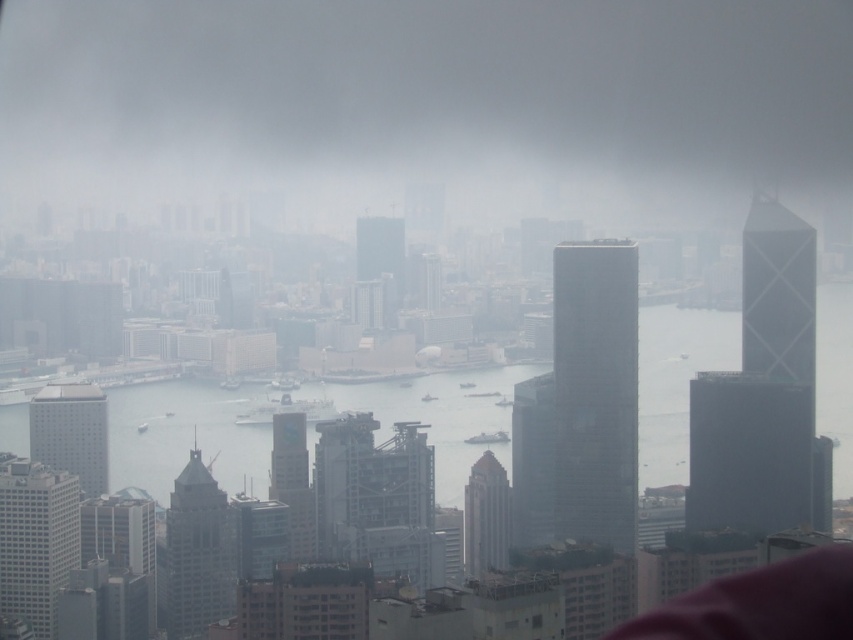
You are standing at the center of the city and want to locate the gray glass skyscraper at center. According to the coordinates provided, where exactly is it positioned?

The gray glass skyscraper at center is located at the 2D coordinates point (x=485, y=516).

You are a drone operator trying to navigate through the city. You see a gray glass skyscraper at center. Can you confirm if the point at coordinates [485,516] corresponds to this building?

Yes, the gray glass skyscraper at center is represented by point [485,516].

You are standing at a viewpoint overlooking the city and want to know how far the point at coordinates point (656, 83) is from your current position. Can you determine the distance?

The point (656, 83) is 669.47 meters away from the viewer.